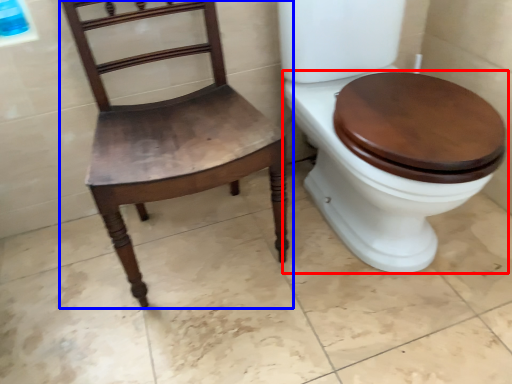
Question: Which of the following is the farthest to the observer, toilet (highlighted by a red box) or chair (highlighted by a blue box)?

Choices:
 (A) toilet
 (B) chair

Answer: (B)